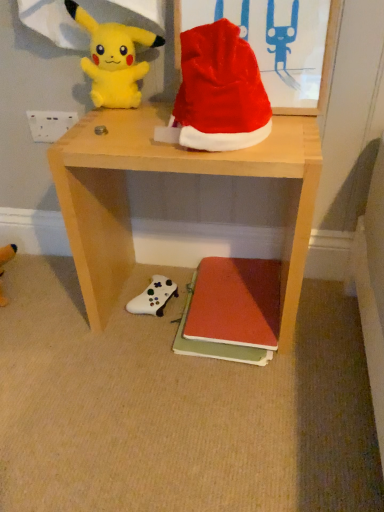
The width and height of the screenshot is (384, 512). In order to click on vacant area situated to the left side of shiny fabric santa hat at upper center in this screenshot , I will do `click(129, 128)`.